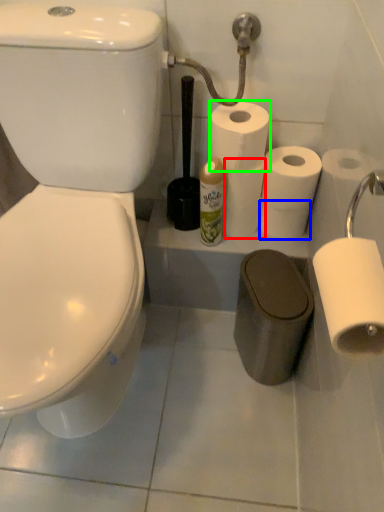
Question: Which object is positioned closest to toilet paper (highlighted by a red box)? Select from toilet paper (highlighted by a blue box) and toilet paper (highlighted by a green box).

Choices:
 (A) toilet paper
 (B) toilet paper

Answer: (A)